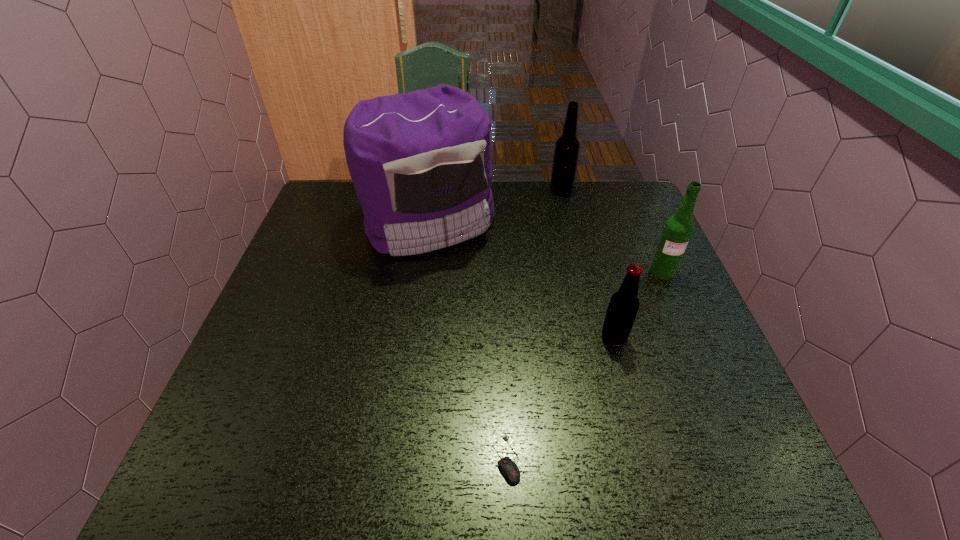
You are a GUI agent. You are given a task and a screenshot of the screen. Output one action in this format:
    pyautogui.click(x=<x>, y=<y>)
    Task: Click on the vacant space that satisfies the following two spatial constraints: 1. on the back side of the farthest beer bottle; 2. on the right side of the shortest object
    
    Given the screenshot: What is the action you would take?
    tap(494, 190)